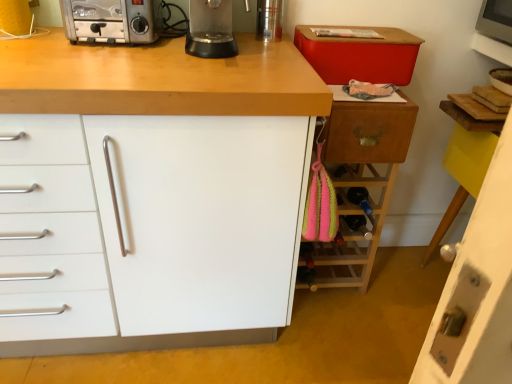
Question: Considering the positions of wooden wine rack at right, arranged as the 2th cabinetry when viewed from the left, and wooden drawer at right in the image, is wooden wine rack at right, arranged as the 2th cabinetry when viewed from the left, bigger or smaller than wooden drawer at right?

Choices:
 (A) small
 (B) big

Answer: (B)

Question: From the image's perspective, is wooden wine rack at right, the 2th cabinetry positioned from the right, above or below wooden drawer at right?

Choices:
 (A) above
 (B) below

Answer: (B)

Question: Which is farther from the transparent plastic blender at center?

Choices:
 (A) silver metallic toaster at upper left
 (B) wooden drawer at right
 (C) wooden wine rack at right, arranged as the 2th cabinetry when viewed from the left
 (D) white matte cabinet at center, the 3th cabinetry in the right-to-left sequence
 (E) white glossy door at lower right, the 1th cabinetry in the right-to-left sequence

Answer: (E)

Question: Which object is positioned closest to the transparent plastic blender at center?

Choices:
 (A) white glossy door at lower right, the 1th cabinetry in the right-to-left sequence
 (B) wooden wine rack at right, the 2th cabinetry positioned from the right
 (C) wooden drawer at right
 (D) white matte cabinet at center, the 3th cabinetry in the right-to-left sequence
 (E) silver metallic toaster at upper left

Answer: (D)